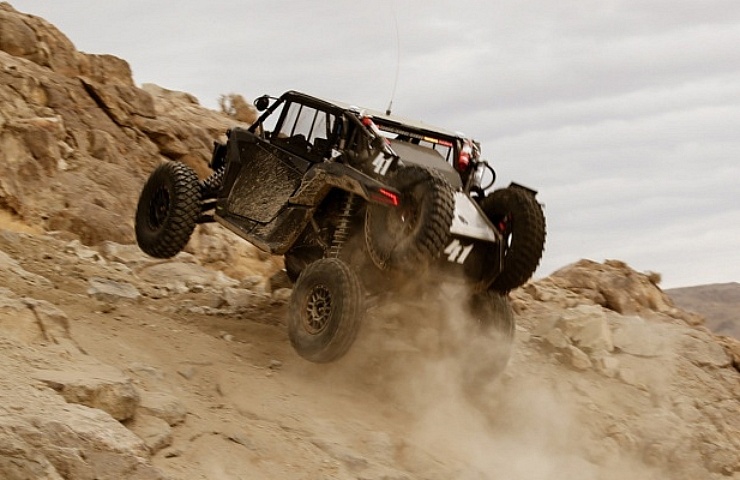
Identify the location of mirror. This screenshot has height=480, width=740. (258, 102).